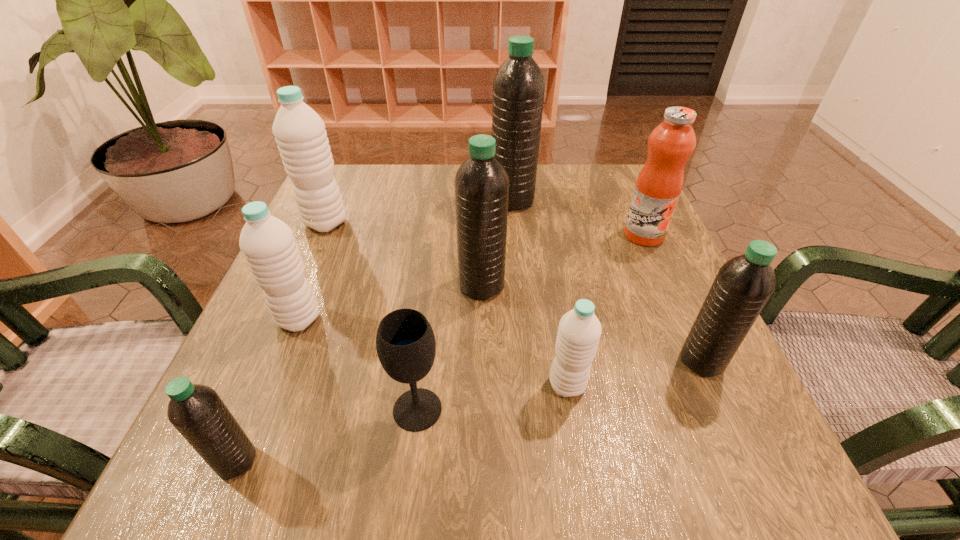
Where is `the tallest water bottle`? the tallest water bottle is located at coordinates (518, 88).

You are a GUI agent. You are given a task and a screenshot of the screen. Output one action in this format:
    pyautogui.click(x=<x>, y=<y>)
    Task: Click on the farthest black water bottle
    The width and height of the screenshot is (960, 540).
    Given the screenshot: What is the action you would take?
    pyautogui.click(x=518, y=88)

At what (x,y) coordinates should I click in order to perform the action: click on the farthest white water bottle. Please return your answer as a coordinate pair (x, y). This screenshot has height=540, width=960. Looking at the image, I should click on (300, 134).

Locate an element on the screen. the sixth nearest object is located at coordinates (481, 183).

The width and height of the screenshot is (960, 540). Identify the location of the second farthest black water bottle. (481, 183).

At what (x,y) coordinates should I click in order to perform the action: click on fruit juice. Please return your answer as a coordinate pair (x, y). Looking at the image, I should click on (659, 184).

The height and width of the screenshot is (540, 960). What are the coordinates of `the second smallest white water bottle` in the screenshot? It's located at [x=268, y=244].

Identify the location of the fifth nearest object. The width and height of the screenshot is (960, 540). (268, 244).

This screenshot has width=960, height=540. I want to click on the third farthest black water bottle, so click(x=743, y=285).

The height and width of the screenshot is (540, 960). In order to click on the third biggest black water bottle in this screenshot , I will do `click(743, 285)`.